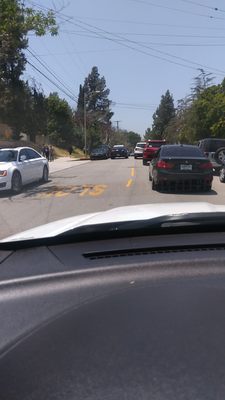
Identify the location of vent. This screenshot has height=400, width=225. (127, 255).